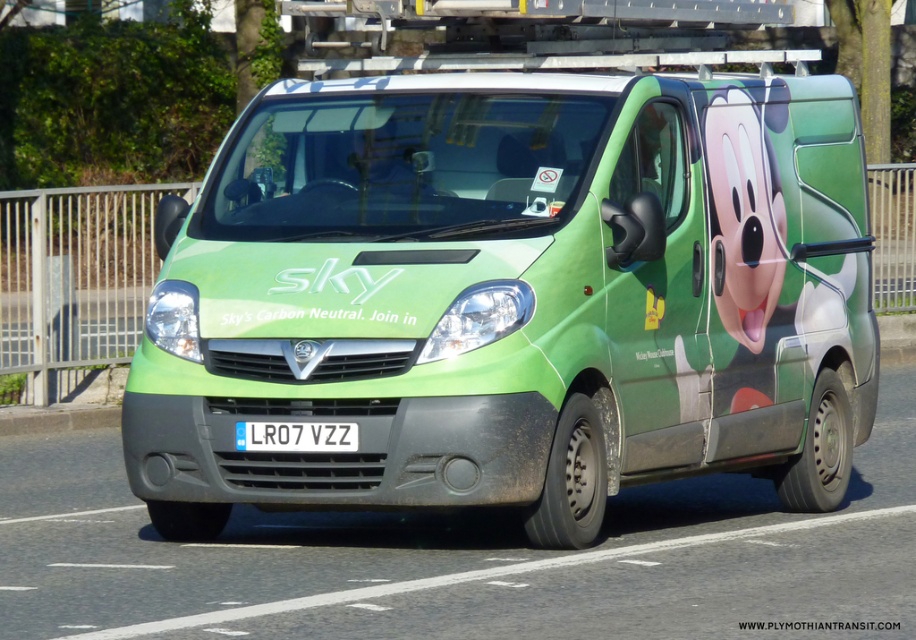
Question: Among these objects, which one is nearest to the camera?

Choices:
 (A) white plastic license plate at center
 (B) green matte van at center

Answer: (B)

Question: Can you confirm if green matte van at center is positioned to the left of white plastic license plate at center?

Choices:
 (A) no
 (B) yes

Answer: (A)

Question: Is green matte van at center to the left of white plastic license plate at center from the viewer's perspective?

Choices:
 (A) no
 (B) yes

Answer: (A)

Question: Where is green matte van at center located in relation to white plastic license plate at center in the image?

Choices:
 (A) above
 (B) below

Answer: (A)